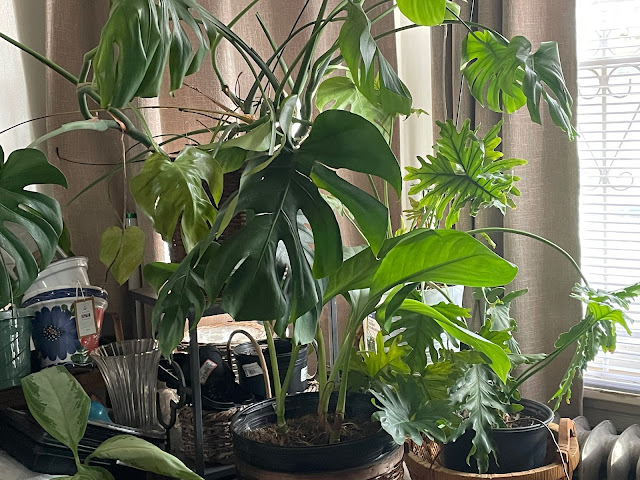
Locate an element on the screen. The height and width of the screenshot is (480, 640). pots without plants is located at coordinates (221, 374), (280, 358), (147, 364), (66, 315), (59, 292), (61, 273).